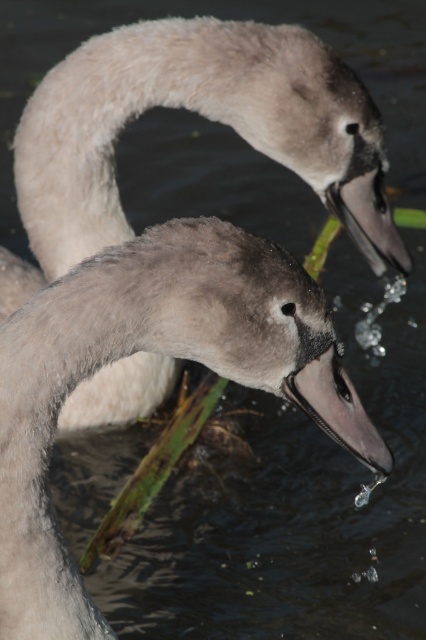
Can you confirm if gray matte swan at center is positioned to the left of gray downy swan at center?

Correct, you'll find gray matte swan at center to the left of gray downy swan at center.

Does gray matte swan at center appear over gray downy swan at center?

Incorrect, gray matte swan at center is not positioned above gray downy swan at center.

Who is more distant from viewer, [114,248] or [209,42]?

The point [209,42] is more distant.

Locate an element on the screen. This screenshot has width=426, height=640. gray matte swan at center is located at coordinates (163, 353).